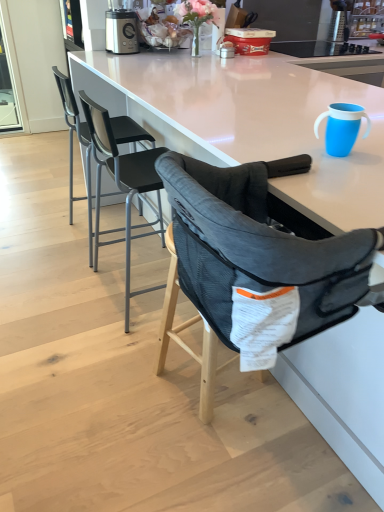
The width and height of the screenshot is (384, 512). I want to click on vacant area that is in front of black mesh chair at upper left, placed as the 3th chair when sorted from front to back, so pos(57,276).